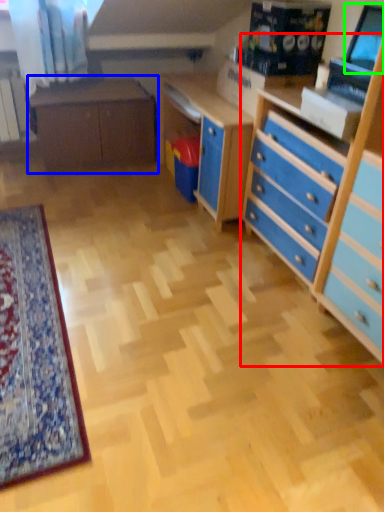
Question: Based on their relative distances, which object is nearer to chest of drawers (highlighted by a red box)? Choose from table (highlighted by a blue box) and computer monitor (highlighted by a green box).

Choices:
 (A) table
 (B) computer monitor

Answer: (B)